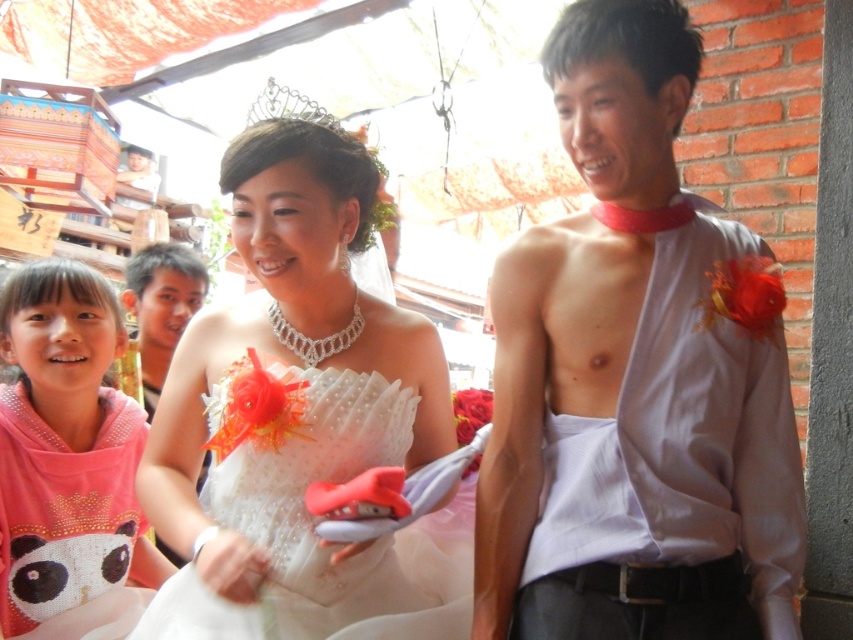
Is matte gray shirt at right shorter than pink fabric at left?

In fact, matte gray shirt at right may be taller than pink fabric at left.

Does point (749, 336) come in front of point (57, 312)?

Yes, point (749, 336) is in front of point (57, 312).

What are the coordinates of `matte gray shirt at right` in the screenshot? It's located at (631, 380).

Does matte gray shirt at right appear on the left side of matte black hair at upper left?

Incorrect, matte gray shirt at right is not on the left side of matte black hair at upper left.

Consider the image. Can you confirm if matte gray shirt at right is smaller than matte black hair at upper left?

Incorrect, matte gray shirt at right is not smaller in size than matte black hair at upper left.

Who is more forward, [683,115] or [164,280]?

Point [683,115] is in front.

Find the location of `matte gray shirt at right`. matte gray shirt at right is located at coordinates (631, 380).

Between white satin dress at center and matte black hair at upper left, which one is positioned lower?

white satin dress at center is lower down.

Based on the photo, is white satin dress at center taller than matte black hair at upper left?

Yes, white satin dress at center is taller than matte black hair at upper left.

Between point (386, 408) and point (170, 264), which one is positioned behind?

Positioned behind is point (170, 264).

Find the location of a particular element. white satin dress at center is located at coordinates [302, 417].